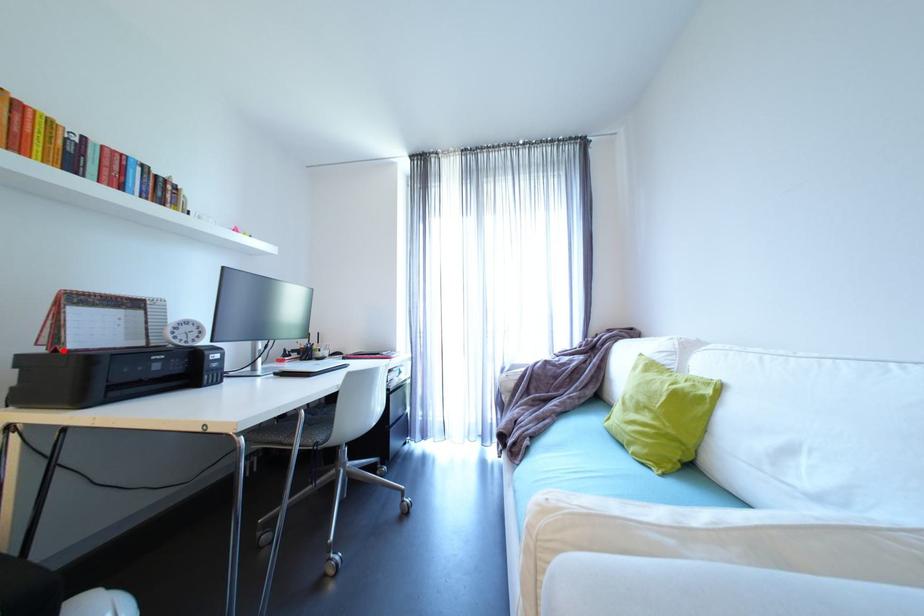
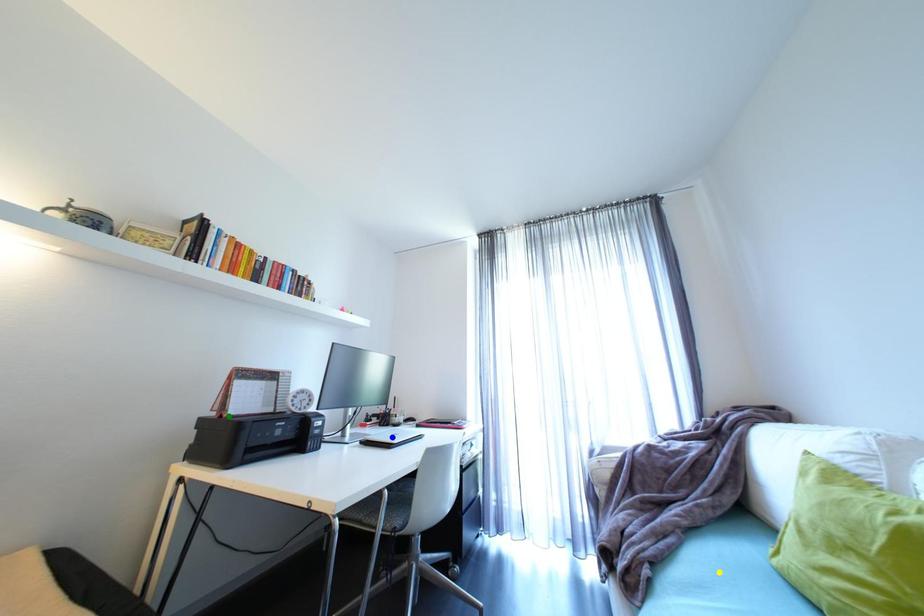
Question: I am providing you with two images of the same scene from different viewpoints. A red point is marked on the first image. You are given multiple points on the second image. Which spot in image 2 lines up with the point in image 1?

Choices:
 (A) yellow point
 (B) green point
 (C) blue point

Answer: (B)